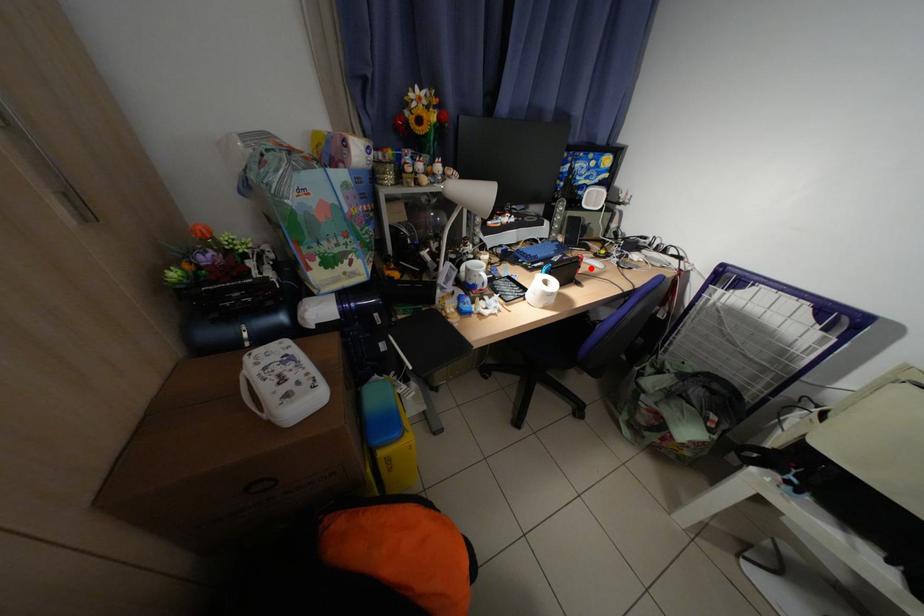
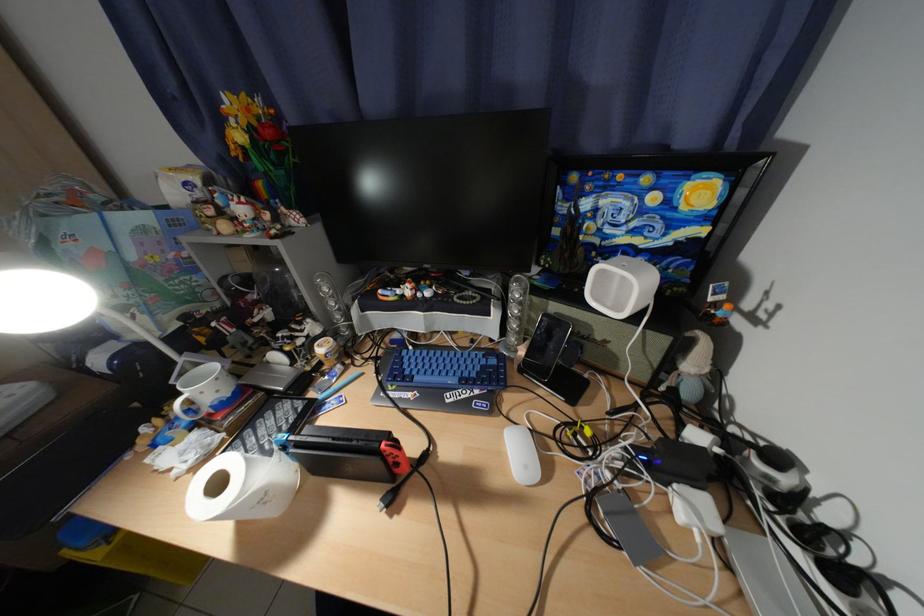
Where in the second image is the point corresponding to the highlighted location from the first image?

(408, 466)